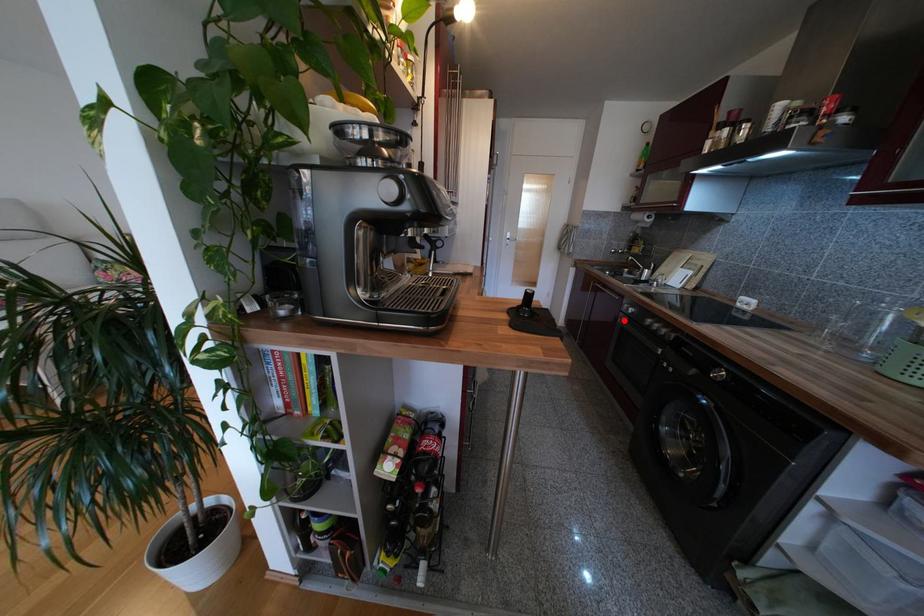
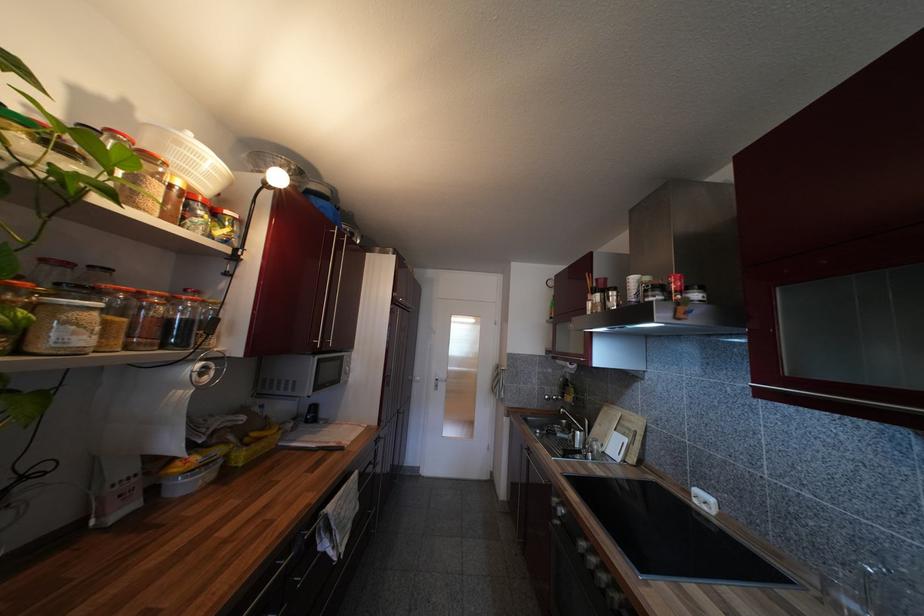
Locate, in the second image, the point that corresponds to the highlighted location in the first image.

(554, 525)